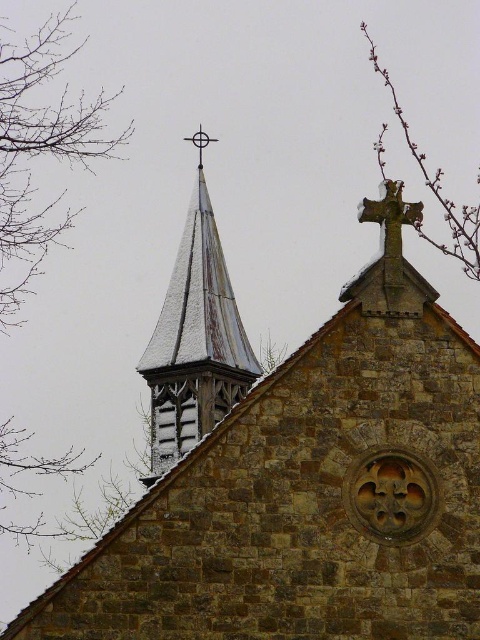
You are a drone operator tasked with capturing aerial footage of the brown stone church steeple at upper left and the white wooden spire at upper left. The drone has a maximum flight range of 6 meters. Can the drone fly between the two structures without exceeding its range?

The brown stone church steeple at upper left and white wooden spire at upper left are 6.60 meters apart from each other. Since the drone can only fly up to 6 meters, it cannot safely travel between them without exceeding its range.

You are an architect examining the church roof. You notice the white wooden spire at upper left and the brown leafless branches at upper left. Which object occupies a larger area in the image?

→ The brown leafless branches at upper left occupy a larger area in the image compared to the white wooden spire at upper left, as the spire has a smaller size according to the description.

You are a drone operator tasked with capturing aerial footage of the brown stone church steeple at upper left. Your drone is currently hovering at point (296,483). Is your current position directly above the steeple?

Yes, your current position at point (296,483) is directly above the brown stone church steeple at upper left as the coordinates correspond to its location.